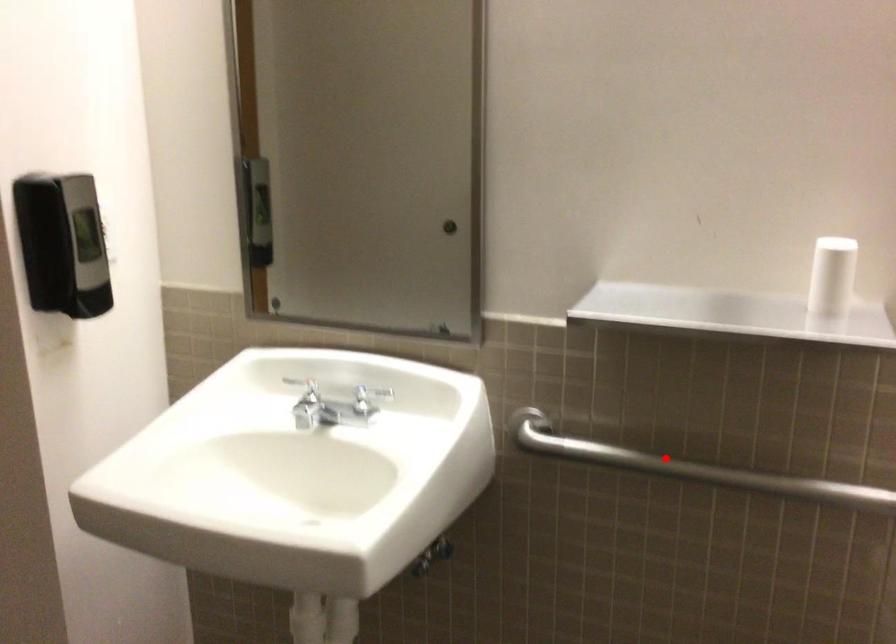
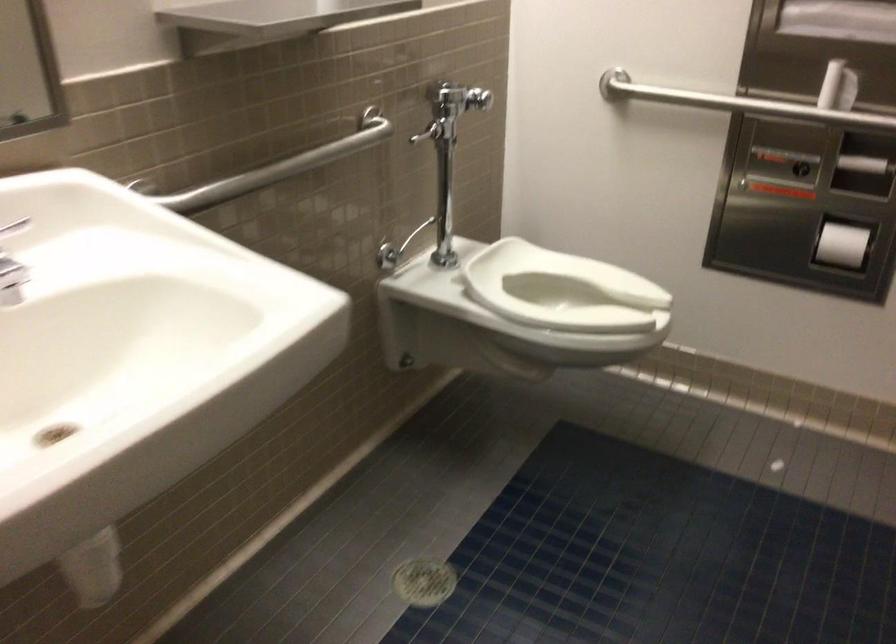
Locate, in the second image, the point that corresponds to the highlighted location in the first image.

(277, 167)